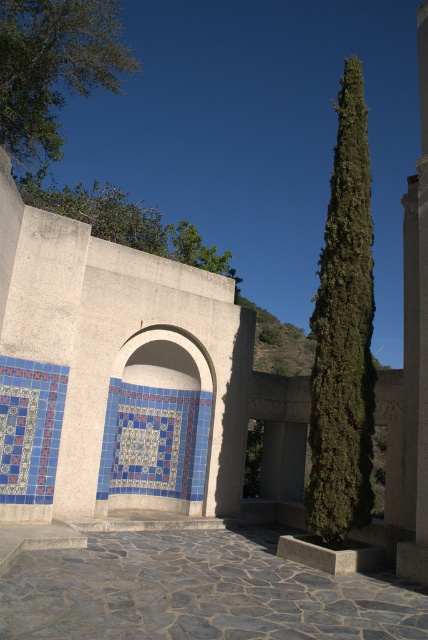
You are standing in front of the building and want to determine which of the two points, point (395, 602) or point (415, 204), is closer to you. Based on the scene description, which point is nearer?

Point (395, 602) is closer to the viewer than point (415, 204).

You are an architect designing a new garden layout. You want to place a bench so that it faces the blue mosaic tile arch at center while keeping it away from the green leafy tree at upper center to avoid shade. Based on the scene description, where should you position the bench?

The blue mosaic tile arch at center is in front of the green leafy tree at upper center, so positioning the bench in front of the arch would place it away from the tree, ensuring it remains in sunlight and faces the arch.